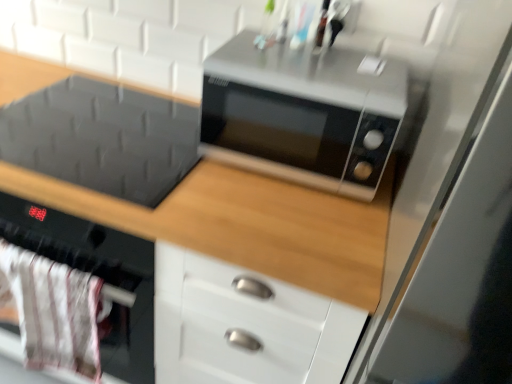
Question: Considering the positions of satin silver microwave at center and matte black microwave at upper center in the image, is satin silver microwave at center wider or thinner than matte black microwave at upper center?

Choices:
 (A) thin
 (B) wide

Answer: (A)

Question: Considering the relative positions of satin silver microwave at center and matte black microwave at upper center in the image provided, is satin silver microwave at center to the left or to the right of matte black microwave at upper center?

Choices:
 (A) right
 (B) left

Answer: (A)

Question: Considering the real-world distances, which object is farthest from the matte black microwave at upper center?

Choices:
 (A) satin silver microwave at center
 (B) transparent glass door at right
 (C) white fabric oven at lower left

Answer: (B)

Question: Which is farther from the white fabric oven at lower left?

Choices:
 (A) transparent glass door at right
 (B) satin silver microwave at center
 (C) matte black microwave at upper center

Answer: (A)